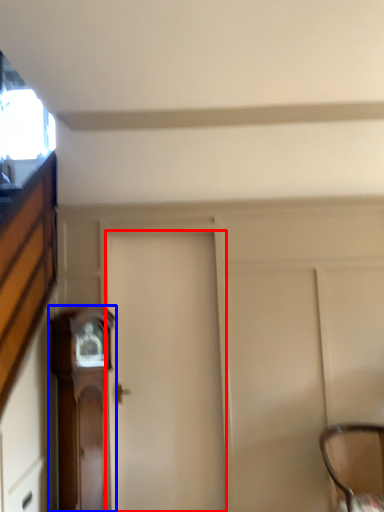
Question: Which object is closer to the camera taking this photo, door (highlighted by a red box) or furniture (highlighted by a blue box)?

Choices:
 (A) door
 (B) furniture

Answer: (B)